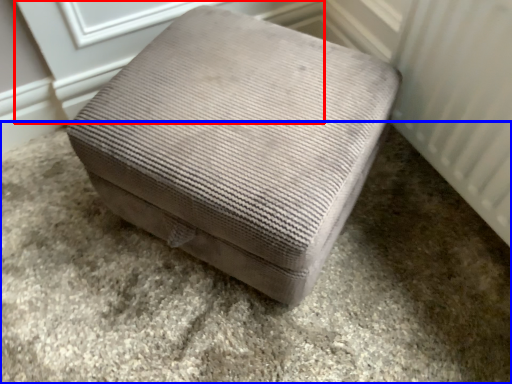
Question: Which of the following is the farthest to the observer, screen door (highlighted by a red box) or concrete (highlighted by a blue box)?

Choices:
 (A) screen door
 (B) concrete

Answer: (A)